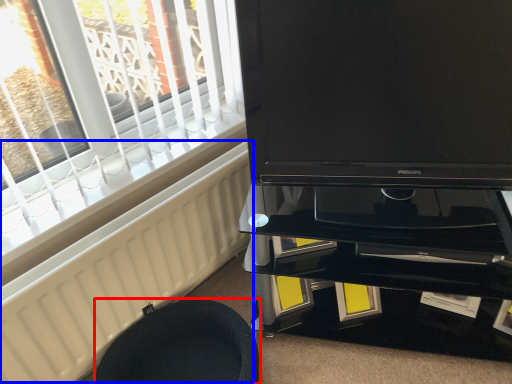
Question: Which object appears farthest to the camera in this image, furniture (highlighted by a red box) or radiator (highlighted by a blue box)?

Choices:
 (A) furniture
 (B) radiator

Answer: (A)